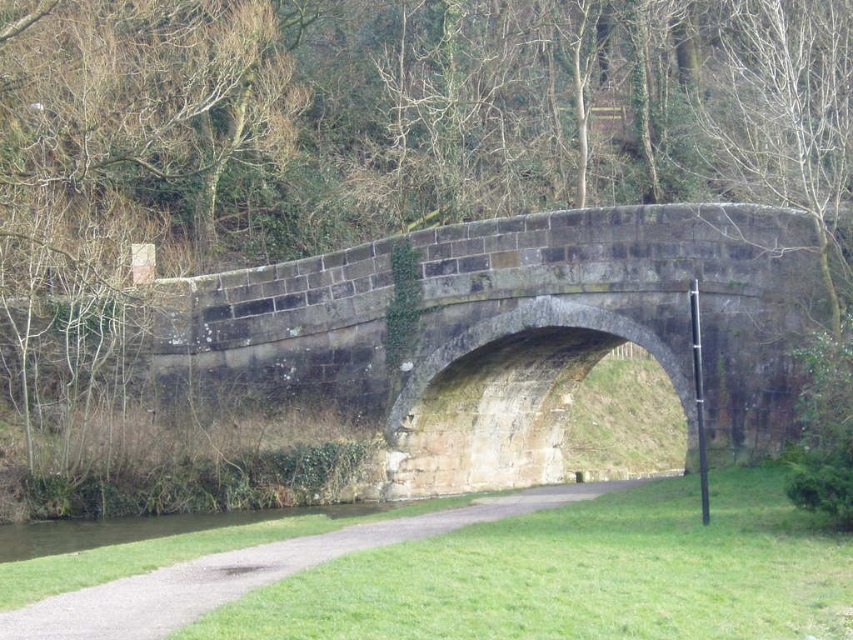
Can you confirm if dark gray stone bridge at center is positioned below gravel path at center?

No, dark gray stone bridge at center is not below gravel path at center.

Locate an element on the screen. Image resolution: width=853 pixels, height=640 pixels. dark gray stone bridge at center is located at coordinates (509, 332).

Between point (786, 355) and point (254, 584), which one is positioned in front?

Positioned in front is point (254, 584).

You are a GUI agent. You are given a task and a screenshot of the screen. Output one action in this format:
    pyautogui.click(x=<x>, y=<y>)
    Task: Click on the dark gray stone bridge at center
    Image resolution: width=853 pixels, height=640 pixels.
    Given the screenshot: What is the action you would take?
    pyautogui.click(x=509, y=332)

Who is taller, gravel path at center or green grassy water at lower left?

gravel path at center is taller.

Which is more to the left, gravel path at center or green grassy water at lower left?

green grassy water at lower left

Measure the distance between point [233,589] and camera.

Point [233,589] and camera are 26.78 meters apart from each other.

Where is `gravel path at center`? The width and height of the screenshot is (853, 640). gravel path at center is located at coordinates (253, 570).

Consider the image. Who is shorter, dark gray stone bridge at center or green grassy water at lower left?

green grassy water at lower left

Who is more forward, (265, 304) or (189, 513)?

Point (189, 513) is in front.

Who is more distant from viewer, [683,404] or [10,531]?

Point [10,531]

At what (x,y) coordinates should I click in order to perform the action: click on dark gray stone bridge at center. Please return your answer as a coordinate pair (x, y). Looking at the image, I should click on (509, 332).